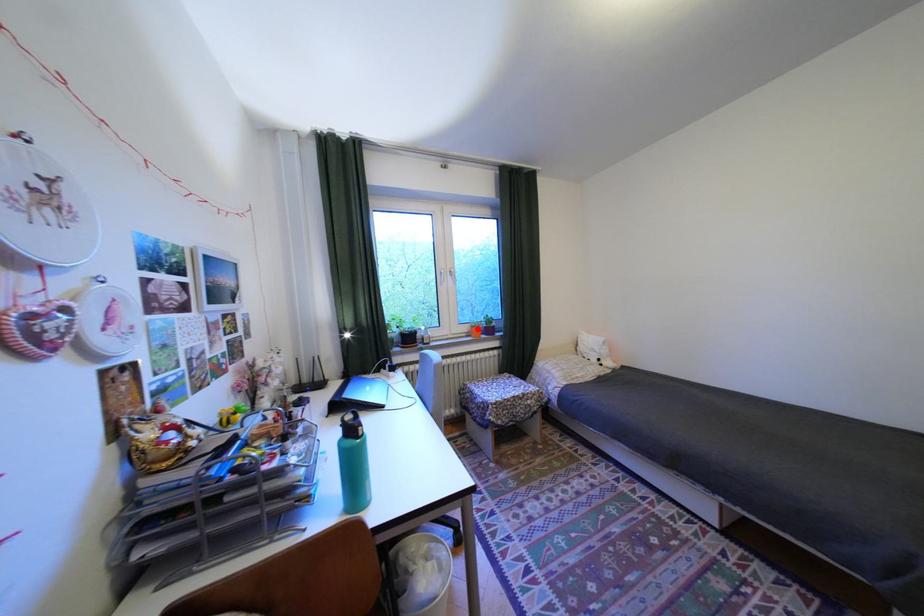
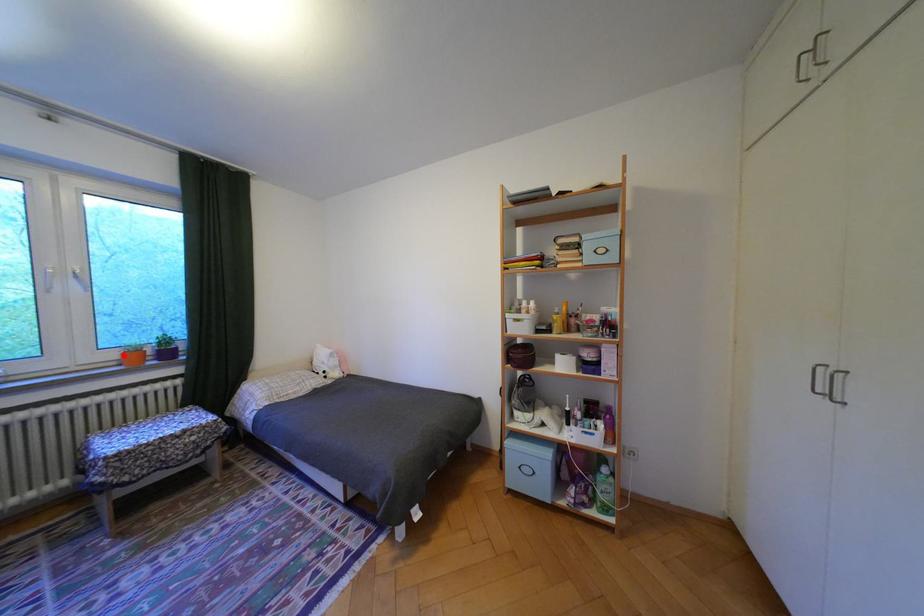
I am providing you with two images of the same scene from different viewpoints. A red point is marked on the first image and another point is marked on the second image. Does the point marked in image1 correspond to the same location as the one in image2?

Yes